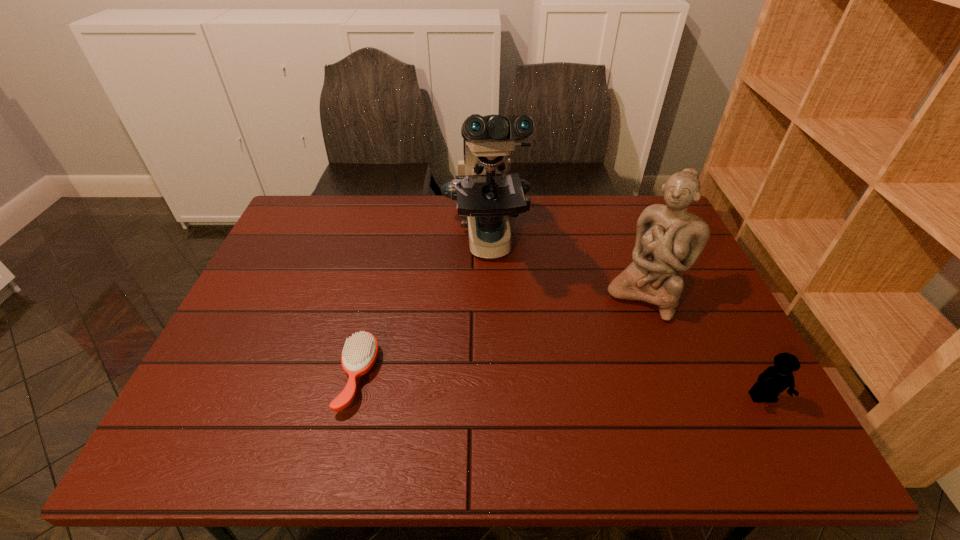
This screenshot has width=960, height=540. In order to click on free space on the desktop that is between the leftmost object and the Lego and is positioned on the front-facing side of the third shortest object in this screenshot , I will do `click(585, 389)`.

Find the location of a particular element. This screenshot has width=960, height=540. free spot on the desktop that is between the hairbrush and the Lego and is positioned through the eyepieces of the microscope is located at coordinates [506, 384].